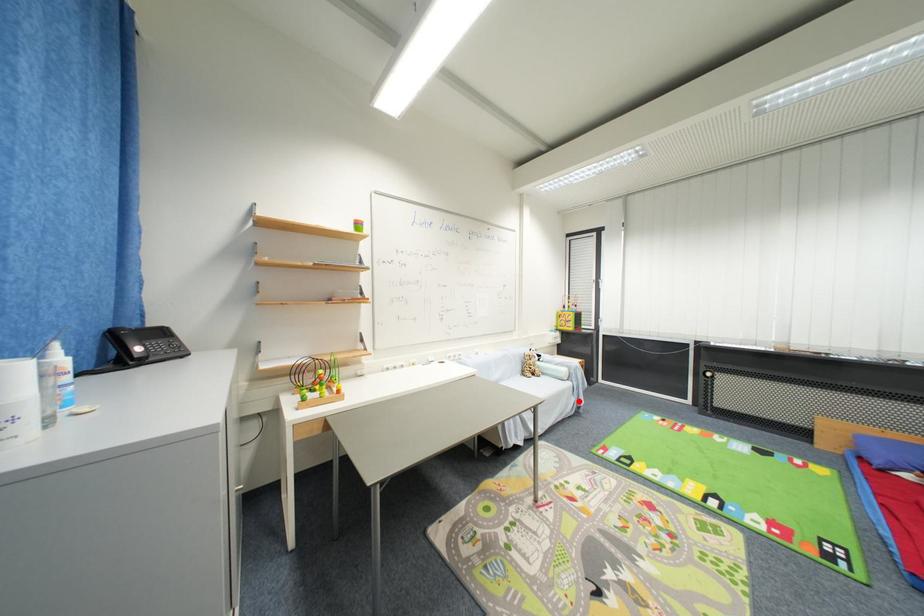
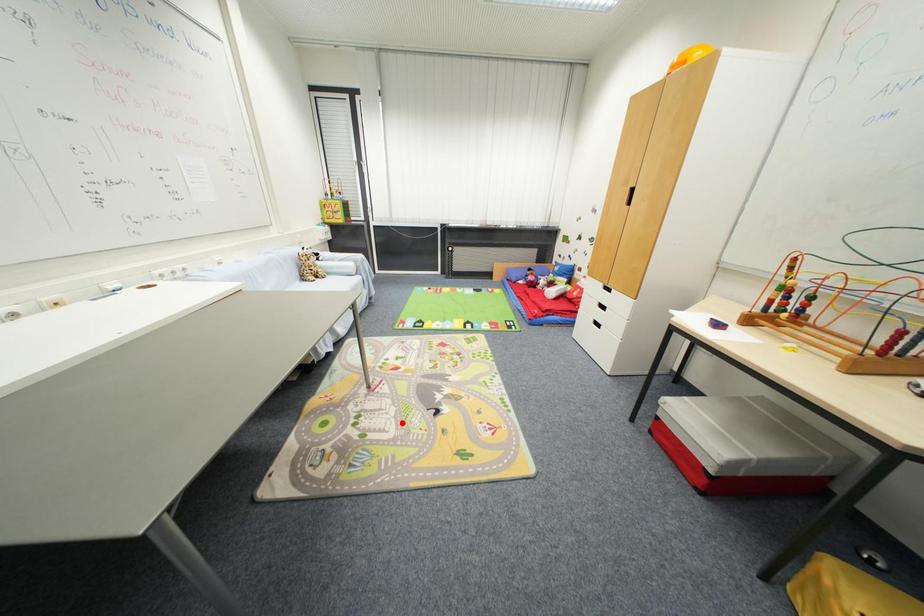
I am providing you with two images of the same scene from different viewpoints. A red point is marked on the first image and another point is marked on the second image. Is the marked point in image1 the same physical position as the marked point in image2?

No